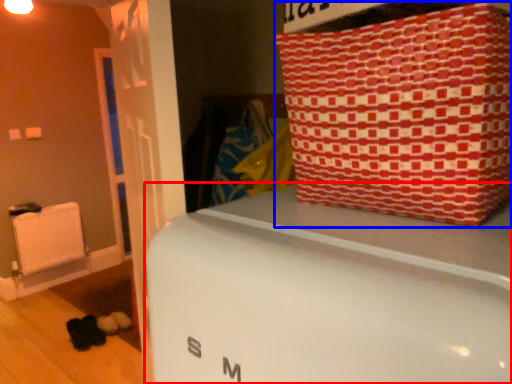
Question: Which of the following is the closest to the observer, furniture (highlighted by a red box) or package (highlighted by a blue box)?

Choices:
 (A) furniture
 (B) package

Answer: (A)